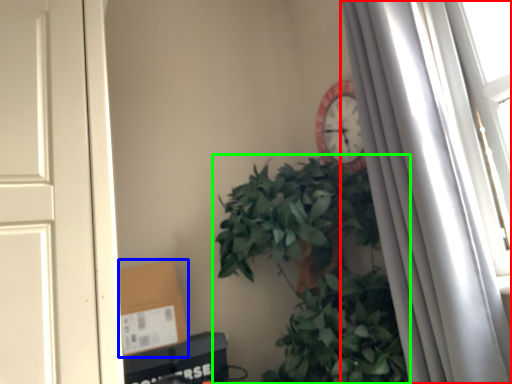
Question: Based on their relative distances, which object is farther from curtain (highlighted by a red box)? Choose from cardboard box (highlighted by a blue box) and houseplant (highlighted by a green box).

Choices:
 (A) cardboard box
 (B) houseplant

Answer: (A)